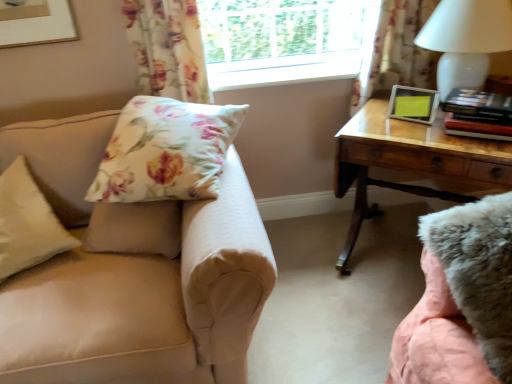
Question: Is wooden desk at right wider than hardcover books at right?

Choices:
 (A) yes
 (B) no

Answer: (A)

Question: From a real-world perspective, is wooden desk at right physically above hardcover books at right?

Choices:
 (A) yes
 (B) no

Answer: (B)

Question: Is wooden desk at right oriented towards hardcover books at right?

Choices:
 (A) no
 (B) yes

Answer: (A)

Question: Is wooden desk at right positioned beyond the bounds of hardcover books at right?

Choices:
 (A) no
 (B) yes

Answer: (B)

Question: Considering the relative sizes of wooden desk at right and hardcover books at right in the image provided, is wooden desk at right shorter than hardcover books at right?

Choices:
 (A) no
 (B) yes

Answer: (A)

Question: Based on their sizes in the image, would you say white plastic window frame at upper center is bigger or smaller than floral fabric pillow at upper left, the 1th pillow when ordered from right to left?

Choices:
 (A) small
 (B) big

Answer: (A)

Question: Do you think white plastic window frame at upper center is within floral fabric pillow at upper left, the 1th pillow when ordered from right to left, or outside of it?

Choices:
 (A) inside
 (B) outside

Answer: (B)

Question: Is point (312, 56) closer or farther from the camera than point (202, 157)?

Choices:
 (A) closer
 (B) farther

Answer: (B)

Question: From a real-world perspective, is white plastic window frame at upper center physically located above or below floral fabric pillow at upper left, the 1th pillow when ordered from right to left?

Choices:
 (A) above
 (B) below

Answer: (A)

Question: In terms of width, does transparent glass window at upper center look wider or thinner when compared to floral fabric pillow at upper left, the 1th pillow when ordered from right to left?

Choices:
 (A) thin
 (B) wide

Answer: (A)

Question: From a real-world perspective, is transparent glass window at upper center physically located above or below floral fabric pillow at upper left, the 1th pillow when ordered from right to left?

Choices:
 (A) above
 (B) below

Answer: (A)

Question: Does point (330, 4) appear closer or farther from the camera than point (190, 147)?

Choices:
 (A) closer
 (B) farther

Answer: (B)

Question: Based on their sizes in the image, would you say transparent glass window at upper center is bigger or smaller than floral fabric pillow at upper left, the 1th pillow when ordered from right to left?

Choices:
 (A) small
 (B) big

Answer: (A)

Question: Considering the positions of hardcover books at right and floral fabric curtain at upper left, which is the second curtain from right to left, in the image, is hardcover books at right taller or shorter than floral fabric curtain at upper left, which is the second curtain from right to left,?

Choices:
 (A) tall
 (B) short

Answer: (B)

Question: In terms of width, does hardcover books at right look wider or thinner when compared to floral fabric curtain at upper left, marked as the first curtain in a left-to-right arrangement?

Choices:
 (A) wide
 (B) thin

Answer: (A)